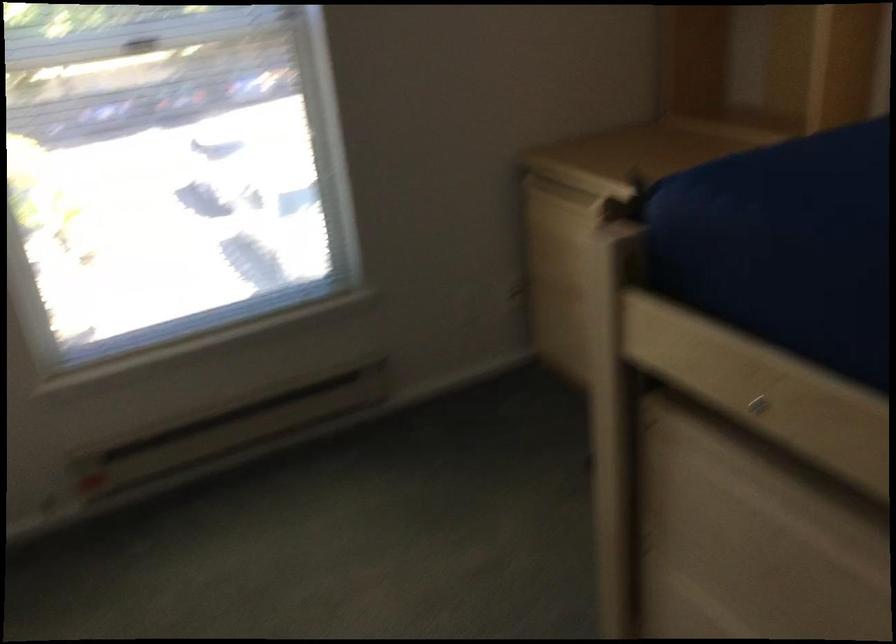
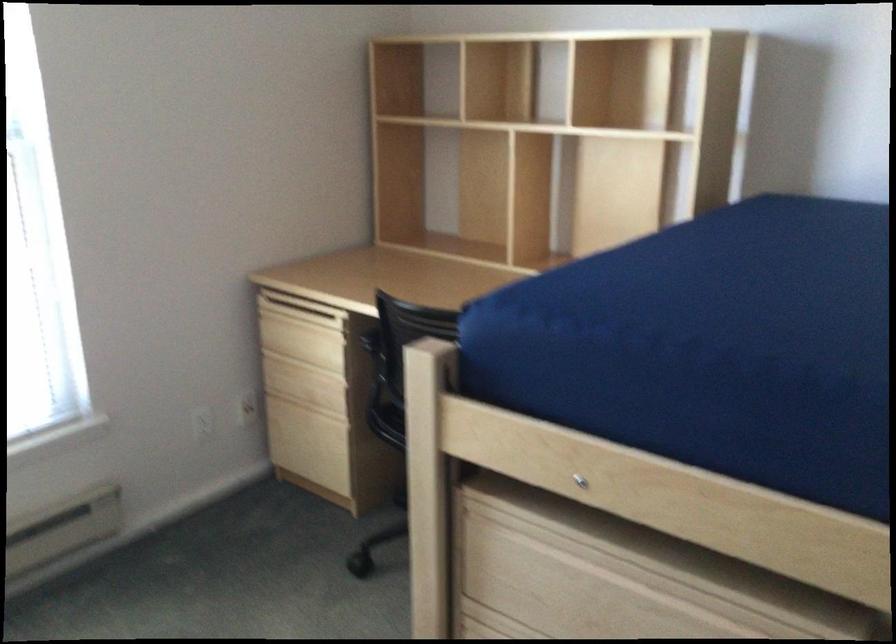
Question: The camera is either moving clockwise (left) or counter-clockwise (right) around the object. The first image is from the beginning of the video and the second image is from the end. Is the camera moving left or right when shooting the video?

Choices:
 (A) Left
 (B) Right

Answer: (A)